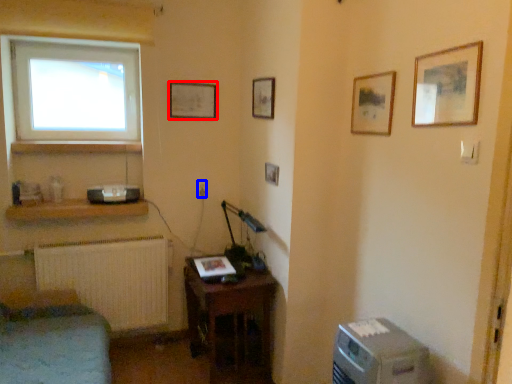
Question: Which point is closer to the camera, picture frame (highlighted by a red box) or electric outlet (highlighted by a blue box)?

Choices:
 (A) picture frame
 (B) electric outlet

Answer: (A)